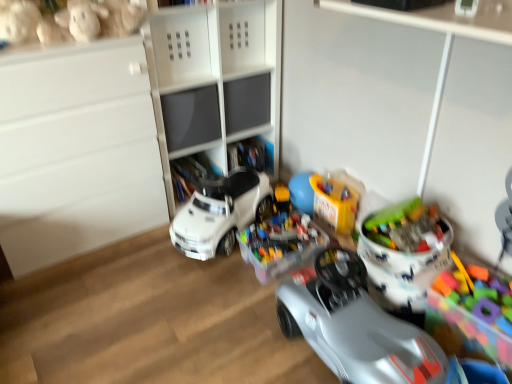
Question: From a real-world perspective, is translucent plastic toy at center right, positioned as the 2th toy in right-to-left order, positioned above or below white matte cabinet at upper center, positioned as the 2th shelf in bottom-to-top order?

Choices:
 (A) below
 (B) above

Answer: (A)

Question: From the image's perspective, is translucent plastic toy at center right, positioned as the 2th toy in right-to-left order, above or below white matte cabinet at upper center, positioned as the 2th shelf in bottom-to-top order?

Choices:
 (A) below
 (B) above

Answer: (A)

Question: Estimate the real-world distances between objects in this image. Which object is closer to the white plastic toy car at center, the 3th toy in the left-to-right sequence?

Choices:
 (A) shiny plastic toy car at center
 (B) translucent plastic container at center, which is the fourth toy from left to right
 (C) white matte cabinet at upper center, positioned as the 2th shelf in bottom-to-top order
 (D) translucent plastic toy at center right, positioned as the 2th toy in right-to-left order
 (E) matte gray cabinet at center, the 1th shelf positioned from the bottom

Answer: (B)

Question: Based on their relative distances, which object is farther from the translucent plastic container at center, which is the fourth toy from left to right?

Choices:
 (A) shiny plastic toy car at center
 (B) matte gray cabinet at center, the 1th shelf positioned from the bottom
 (C) white matte cabinet at upper center, positioned as the 2th shelf in bottom-to-top order
 (D) multicolored plastic blocks at right, the seventh toy in the left-to-right sequence
 (E) white plastic toy car at center, positioned as the fifth toy in right-to-left order

Answer: (C)